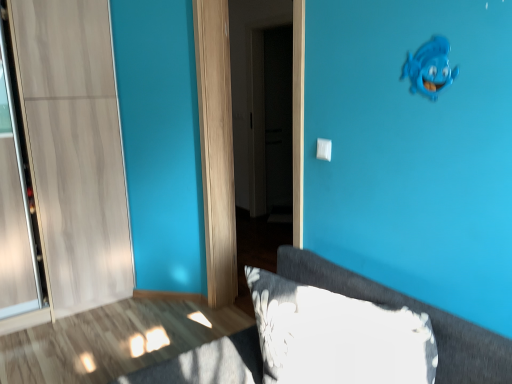
Question: Is fluffy gray pillow at lower right bigger or smaller than white plastic light switch at center?

Choices:
 (A) small
 (B) big

Answer: (B)

Question: Is fluffy gray pillow at lower right taller or shorter than white plastic light switch at center?

Choices:
 (A) tall
 (B) short

Answer: (A)

Question: Which object is the closest to the white glossy door at center?

Choices:
 (A) white plastic light switch at center
 (B) fluffy gray pillow at lower right
 (C) blue matte fish at upper right

Answer: (A)

Question: Which of these objects is positioned farthest from the blue matte fish at upper right?

Choices:
 (A) white plastic light switch at center
 (B) white glossy door at center
 (C) fluffy gray pillow at lower right

Answer: (B)